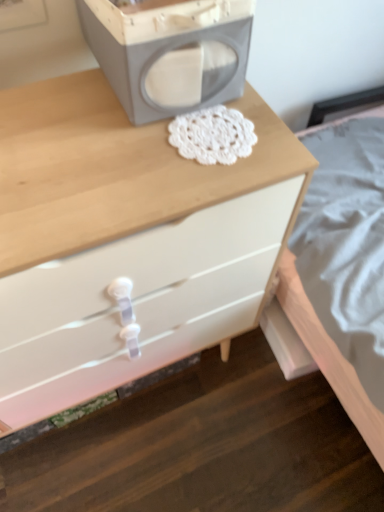
This screenshot has height=512, width=384. Find the location of `free space in front of matte gray speaker at upper center`. free space in front of matte gray speaker at upper center is located at coordinates (114, 158).